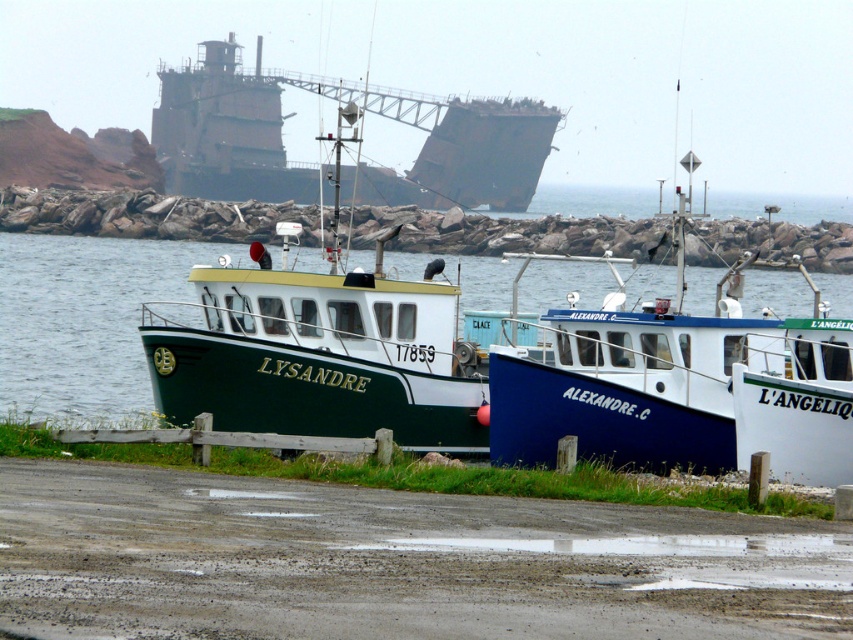
Question: Is damp gray mud at lower center to the left of green matte water at center from the viewer's perspective?

Choices:
 (A) yes
 (B) no

Answer: (B)

Question: Among these points, which one is farthest from the camera?

Choices:
 (A) (309, 419)
 (B) (4, 296)
 (C) (595, 552)

Answer: (B)

Question: Can you confirm if damp gray mud at lower center is positioned above green matte water at center?

Choices:
 (A) yes
 (B) no

Answer: (B)

Question: Which point is farther from the camera taking this photo?

Choices:
 (A) (647, 275)
 (B) (529, 525)

Answer: (A)

Question: In this image, where is damp gray mud at lower center located relative to green matte boat at center?

Choices:
 (A) left
 (B) right

Answer: (B)

Question: Among these objects, which one is nearest to the camera?

Choices:
 (A) green matte water at center
 (B) damp gray mud at lower center

Answer: (B)